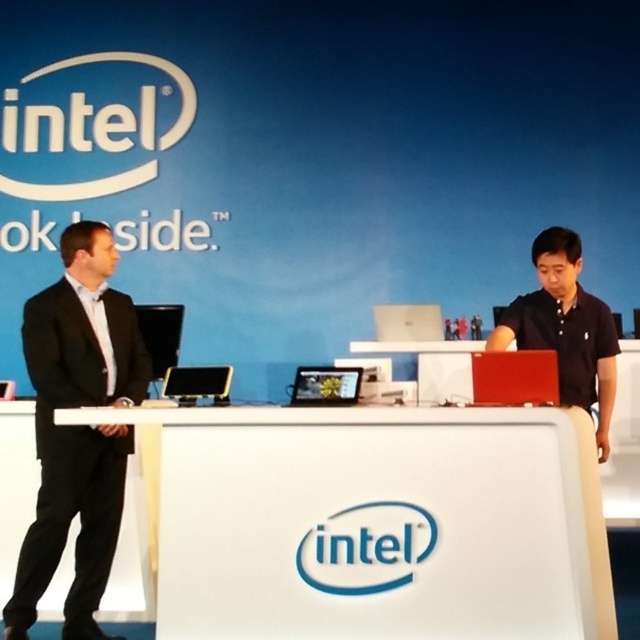
Who is more distant from viewer, (504, 380) or (417, 308)?

Positioned behind is point (417, 308).

At what (x,y) coordinates should I click in order to perform the action: click on matte red laptop at center. Please return your answer as a coordinate pair (x, y). This screenshot has width=640, height=640. Looking at the image, I should click on (515, 378).

Between white plastic information desk at center and matte silver tablet at center, which one has more height?

white plastic information desk at center is taller.

Is the position of white plastic information desk at center less distant than that of matte silver tablet at center?

Yes.

You are a GUI agent. You are given a task and a screenshot of the screen. Output one action in this format:
    pyautogui.click(x=<x>, y=<y>)
    Task: Click on the white plastic information desk at center
    The width and height of the screenshot is (640, 640).
    Given the screenshot: What is the action you would take?
    pyautogui.click(x=376, y=524)

In the scene shown: Is black suit at left shorter than white glossy table at center?

No, black suit at left is not shorter than white glossy table at center.

Is black suit at left behind white glossy table at center?

No.

Is point (90, 484) closer to viewer compared to point (476, 349)?

Yes, point (90, 484) is closer to viewer.

Locate an element on the screen. Image resolution: width=640 pixels, height=640 pixels. black suit at left is located at coordinates (77, 428).